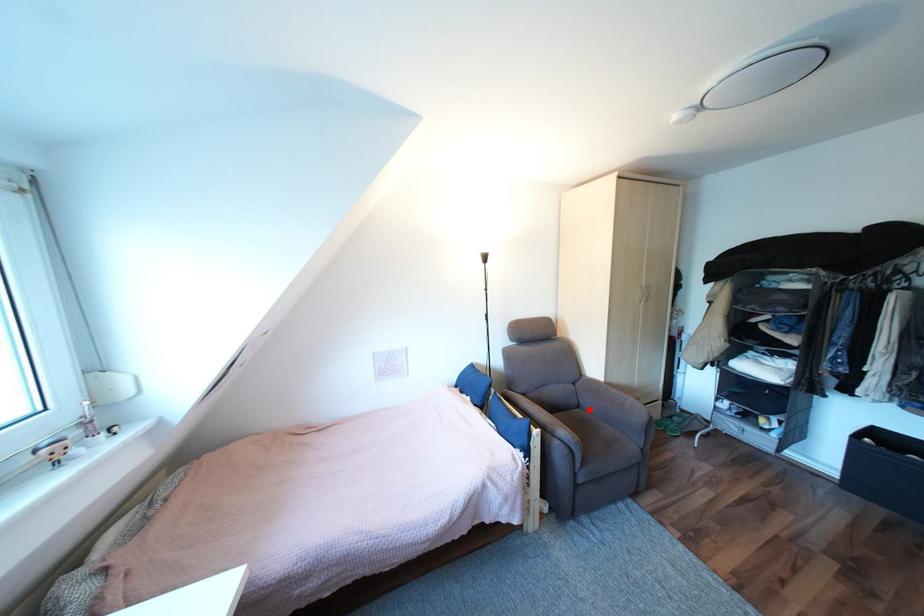
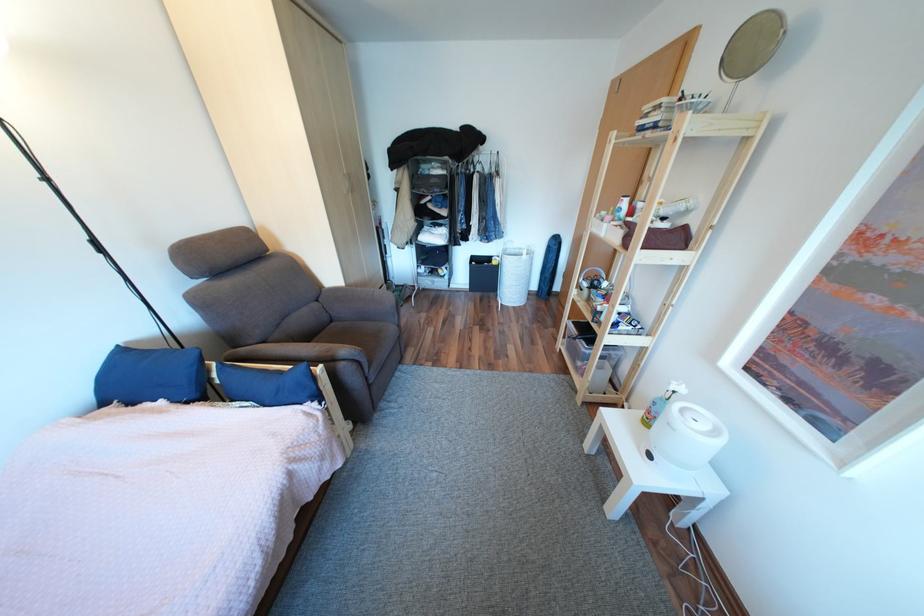
Locate, in the second image, the point that corresponds to the highlighted location in the first image.

(344, 323)